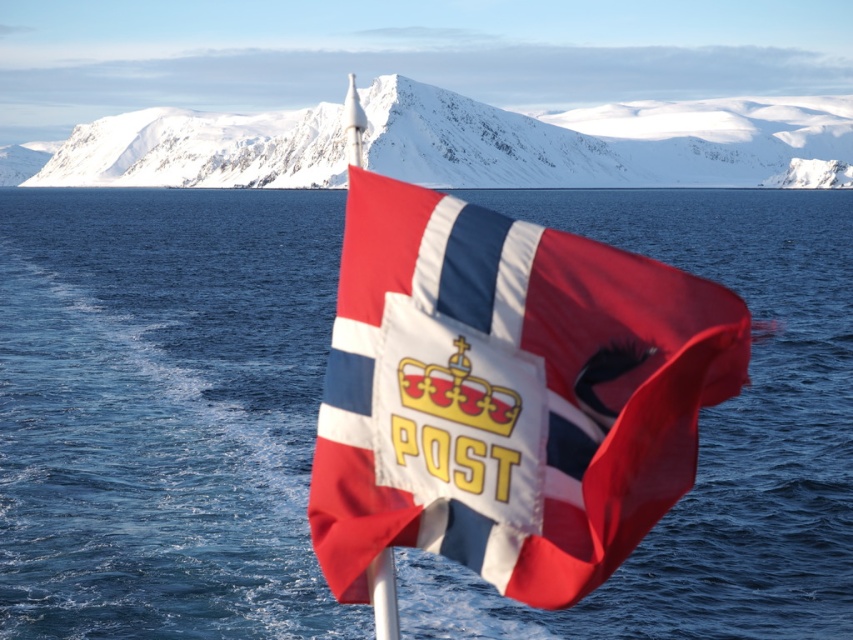
Question: From the image, what is the correct spatial relationship of blue water at center in relation to snowy rock at upper center?

Choices:
 (A) above
 (B) below

Answer: (B)

Question: Can you confirm if blue water at center is positioned above snowy rock at upper center?

Choices:
 (A) yes
 (B) no

Answer: (B)

Question: Is matte fabric flag at center to the left of snowy rock at upper center from the viewer's perspective?

Choices:
 (A) no
 (B) yes

Answer: (B)

Question: Based on their relative distances, which object is nearer to the snowy rock at upper center?

Choices:
 (A) matte fabric flag at center
 (B) blue water at center

Answer: (B)

Question: Estimate the real-world distances between objects in this image. Which object is closer to the matte fabric flag at center?

Choices:
 (A) snowy rock at upper center
 (B) blue water at center

Answer: (B)

Question: Which of the following is the farthest from the observer?

Choices:
 (A) matte fabric flag at center
 (B) snowy rock at upper center

Answer: (B)